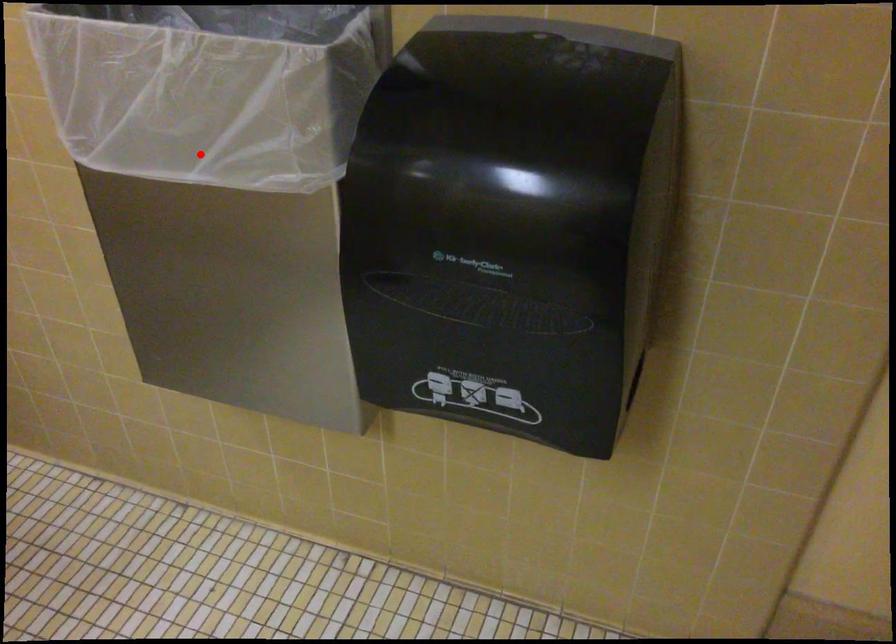
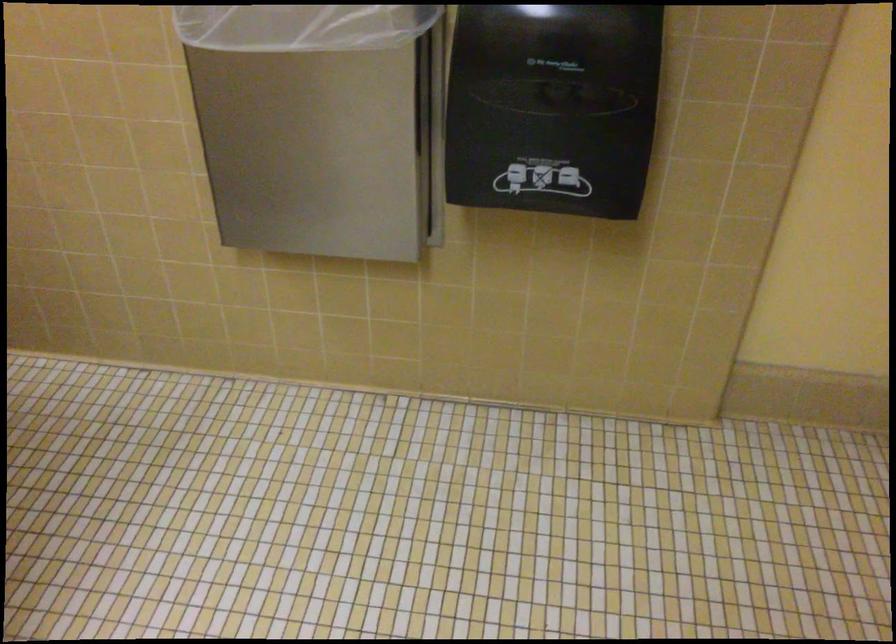
Question: I am providing you with two images of the same scene from different viewpoints. A red point is marked on the first image. Can you still see the location of the red point in image 2?

Choices:
 (A) Yes
 (B) No

Answer: (A)